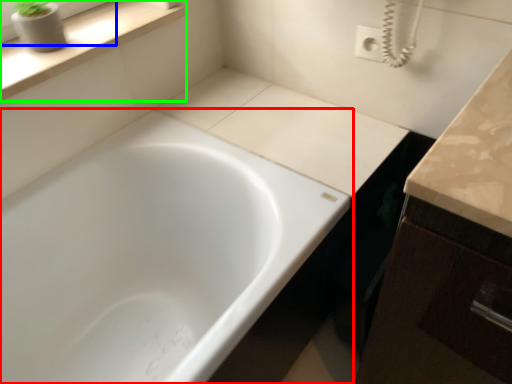
Question: Which object is the closest to the bathtub (highlighted by a red box)? Choose among these: window frame (highlighted by a blue box) or window sill (highlighted by a green box).

Choices:
 (A) window frame
 (B) window sill

Answer: (B)